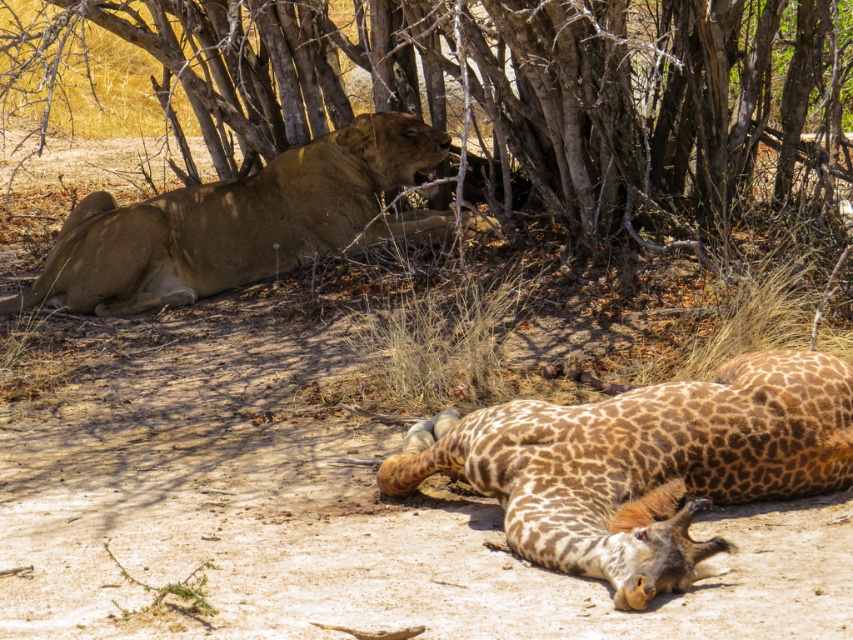
Question: Can you confirm if brown bark tree at upper center is thinner than golden fur lion at center?

Choices:
 (A) no
 (B) yes

Answer: (A)

Question: Which of these objects is positioned farthest from the brown bark tree at upper center?

Choices:
 (A) golden fur lion at lower right
 (B) golden fur lion at center

Answer: (A)

Question: Which object appears farthest from the camera in this image?

Choices:
 (A) golden fur lion at lower right
 (B) golden fur lion at center
 (C) brown bark tree at upper center

Answer: (B)

Question: Does brown bark tree at upper center have a greater width compared to golden fur lion at lower right?

Choices:
 (A) yes
 (B) no

Answer: (A)

Question: Estimate the real-world distances between objects in this image. Which object is farther from the brown bark tree at upper center?

Choices:
 (A) golden fur lion at center
 (B) golden fur lion at lower right

Answer: (B)

Question: Does golden fur lion at lower right have a smaller size compared to golden fur lion at center?

Choices:
 (A) yes
 (B) no

Answer: (A)